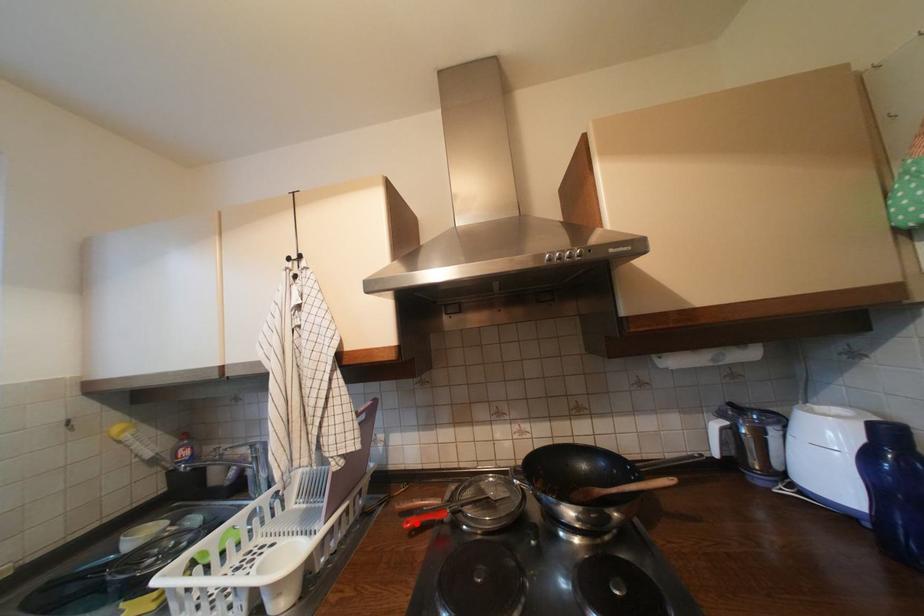
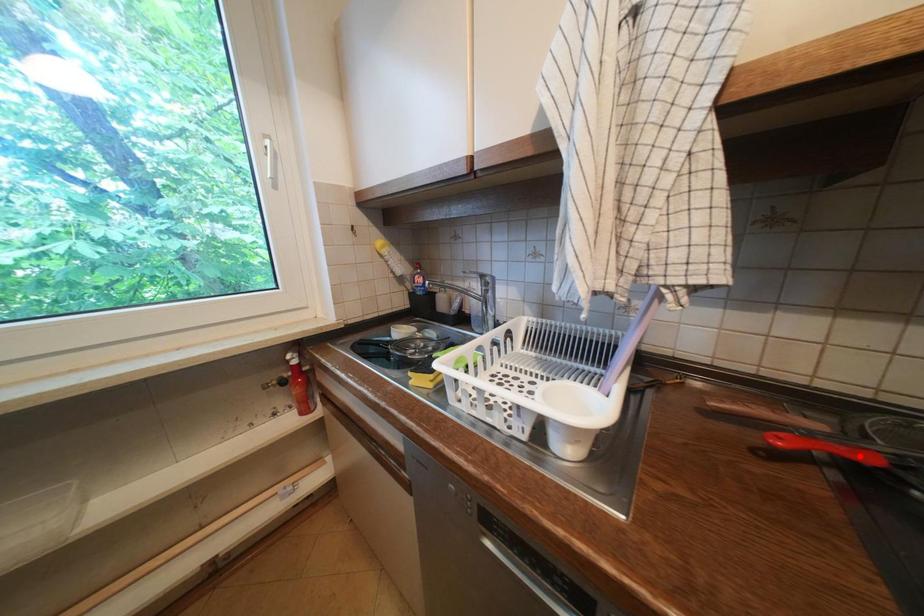
I am providing you with two images of the same scene from different viewpoints. A red point is marked on the first image and another point is marked on the second image. Do the highlighted points in image1 and image2 indicate the same real-world spot?

No